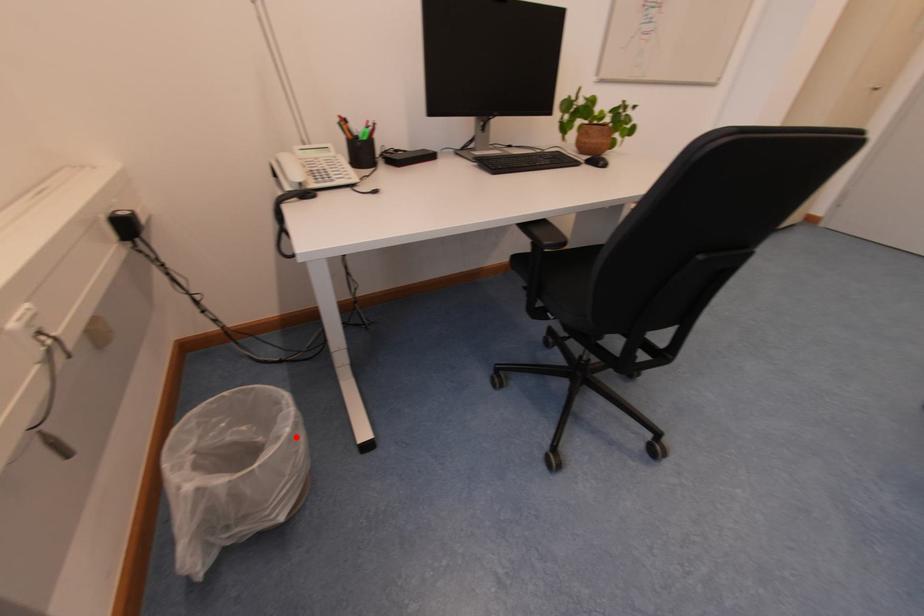
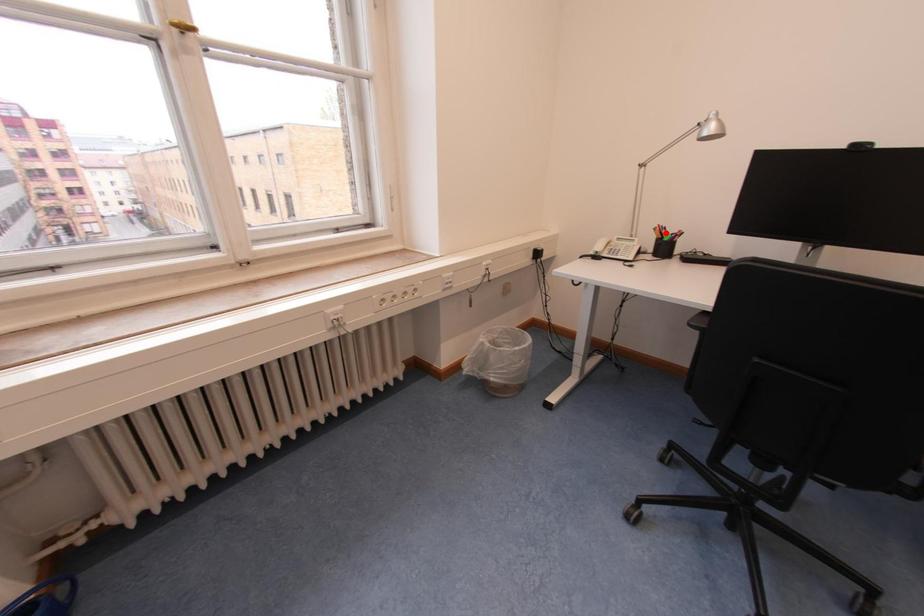
I am providing you with two images of the same scene from different viewpoints. A red point is marked on the first image and another point is marked on the second image. Is the marked point in image1 the same physical position as the marked point in image2?

No